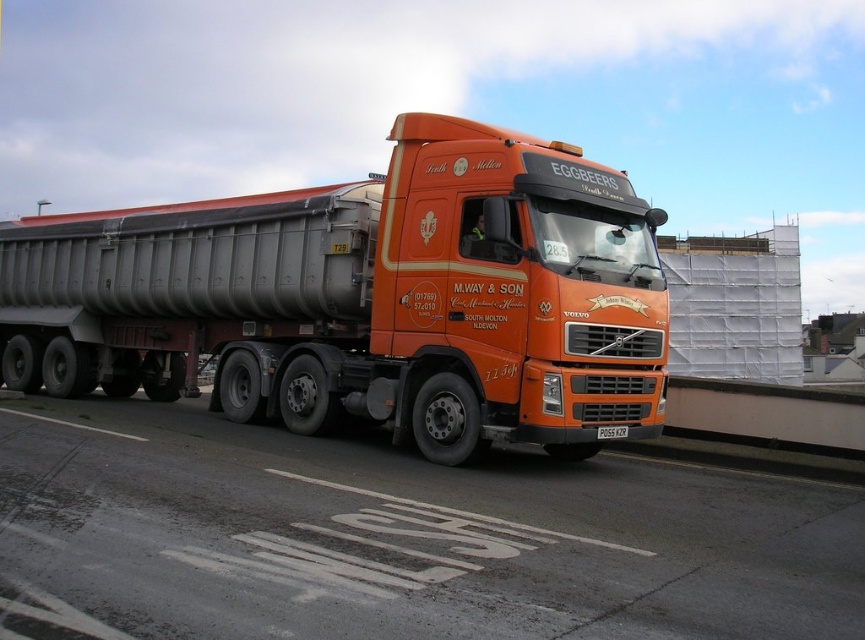
Question: Among these points, which one is nearest to the camera?

Choices:
 (A) (613, 429)
 (B) (411, 396)

Answer: (A)

Question: Observing the image, what is the correct spatial positioning of orange matte truck at center in reference to black plastic license plate at center?

Choices:
 (A) above
 (B) below

Answer: (A)

Question: Is orange metallic truck at center above black plastic license plate at center?

Choices:
 (A) no
 (B) yes

Answer: (A)

Question: Estimate the real-world distances between objects in this image. Which object is farther from the orange metallic truck at center?

Choices:
 (A) black plastic license plate at center
 (B) orange matte truck at center

Answer: (B)

Question: Which of these objects is positioned farthest from the black plastic license plate at center?

Choices:
 (A) orange metallic truck at center
 (B) orange matte truck at center

Answer: (B)

Question: Is orange metallic truck at center positioned before orange matte truck at center?

Choices:
 (A) yes
 (B) no

Answer: (A)